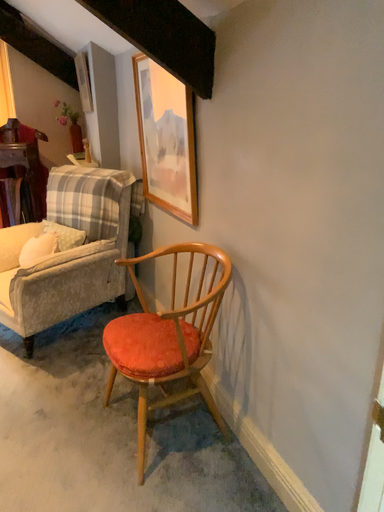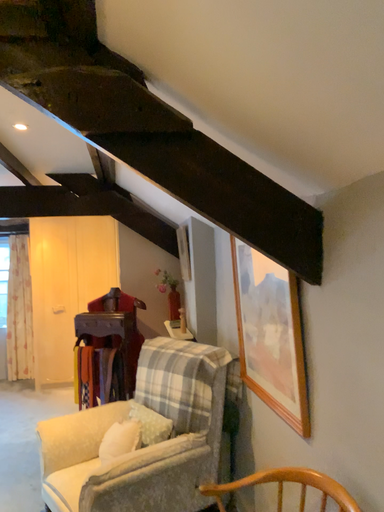
Question: How did the camera likely rotate when shooting the video?

Choices:
 (A) rotated left
 (B) rotated right

Answer: (A)